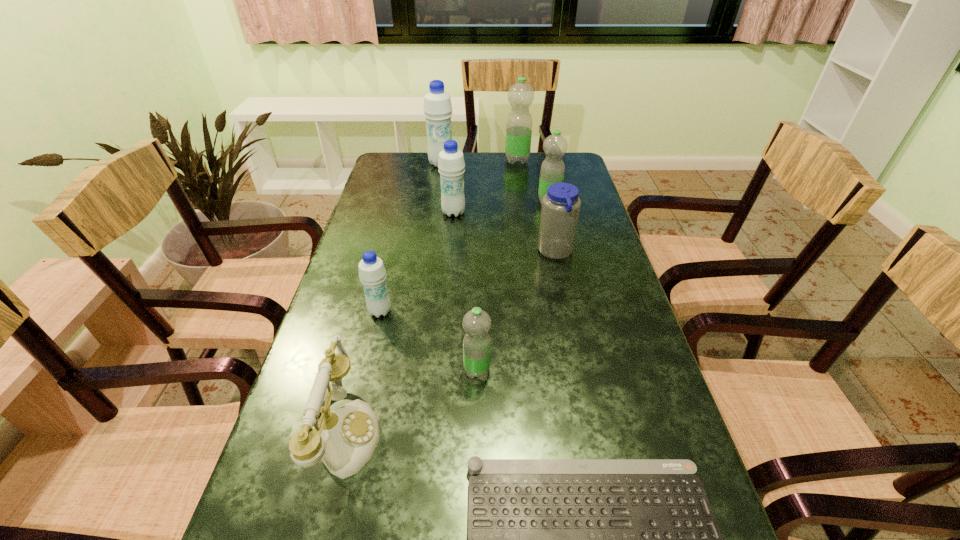
The height and width of the screenshot is (540, 960). I want to click on the fourth water bottle from right to left, so click(476, 323).

The height and width of the screenshot is (540, 960). Identify the location of the smallest green water bottle. (476, 323).

You are a GUI agent. You are given a task and a screenshot of the screen. Output one action in this format:
    pyautogui.click(x=<x>, y=<y>)
    Task: Click on the telephone
    The image size is (960, 540).
    Given the screenshot: What is the action you would take?
    pyautogui.click(x=345, y=439)

Locate an element on the screen. The image size is (960, 540). free region located 0.130m on the right of the farthest green water bottle is located at coordinates (564, 160).

Locate an element on the screen. vacant region located 0.320m on the front of the biggest blue water bottle is located at coordinates (433, 218).

The width and height of the screenshot is (960, 540). Find the location of `blank area located 0.100m on the front of the second nearest green water bottle`. blank area located 0.100m on the front of the second nearest green water bottle is located at coordinates (554, 226).

In order to click on free location located 0.330m on the back of the third nearest blue water bottle in this screenshot , I will do `click(458, 159)`.

Locate an element on the screen. The height and width of the screenshot is (540, 960). free space located 0.360m with a carrying loop on the side of the fifth nearest object is located at coordinates (410, 253).

Locate an element on the screen. The image size is (960, 540). free region located with a carrying loop on the side of the fifth nearest object is located at coordinates (520, 253).

Locate an element on the screen. free space located 0.080m with a carrying loop on the side of the fifth nearest object is located at coordinates (510, 253).